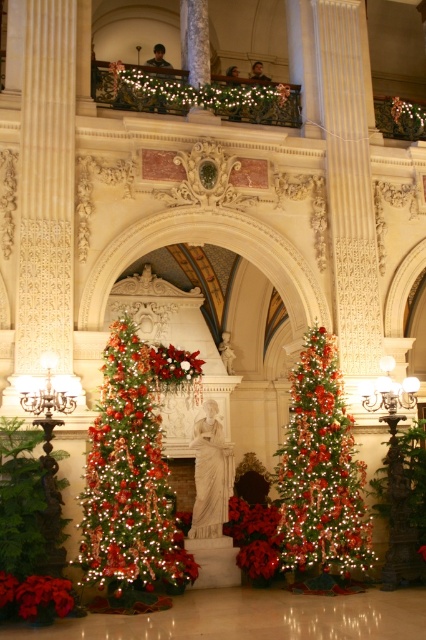
Question: Does shiny green christmas tree at left have a larger size compared to green shiny christmas tree at center?

Choices:
 (A) no
 (B) yes

Answer: (B)

Question: Does shiny green christmas tree at left appear on the right side of green shiny christmas tree at center?

Choices:
 (A) no
 (B) yes

Answer: (A)

Question: Which point appears closest to the camera in this image?

Choices:
 (A) (138, 433)
 (B) (339, 540)

Answer: (A)

Question: Can you confirm if shiny green christmas tree at left is positioned above green shiny christmas tree at center?

Choices:
 (A) yes
 (B) no

Answer: (A)